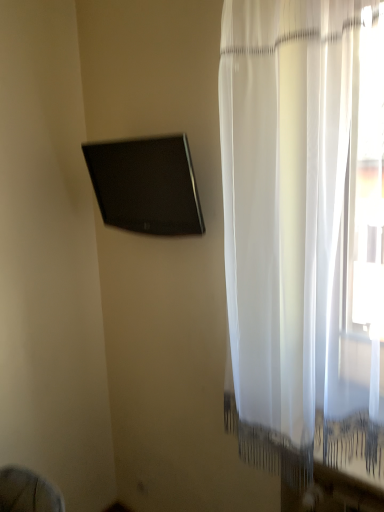
Image resolution: width=384 pixels, height=512 pixels. Find the location of `black glossy tv at upper center`. black glossy tv at upper center is located at coordinates (146, 185).

The image size is (384, 512). Describe the element at coordinates (146, 185) in the screenshot. I see `black glossy tv at upper center` at that location.

You are a GUI agent. You are given a task and a screenshot of the screen. Output one action in this format:
    pyautogui.click(x=<x>, y=<y>)
    Task: Click on the black glossy tv at upper center
    
    Given the screenshot: What is the action you would take?
    pyautogui.click(x=146, y=185)